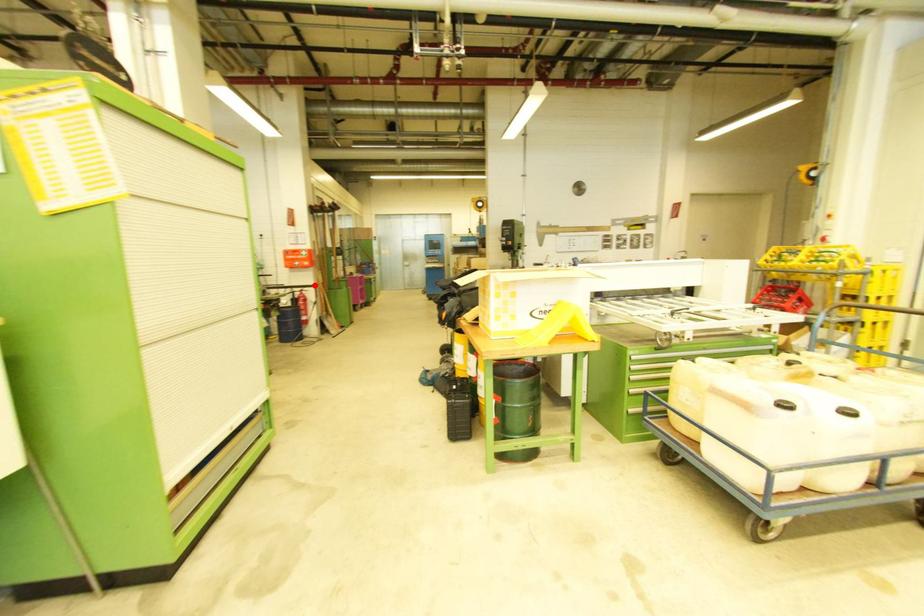
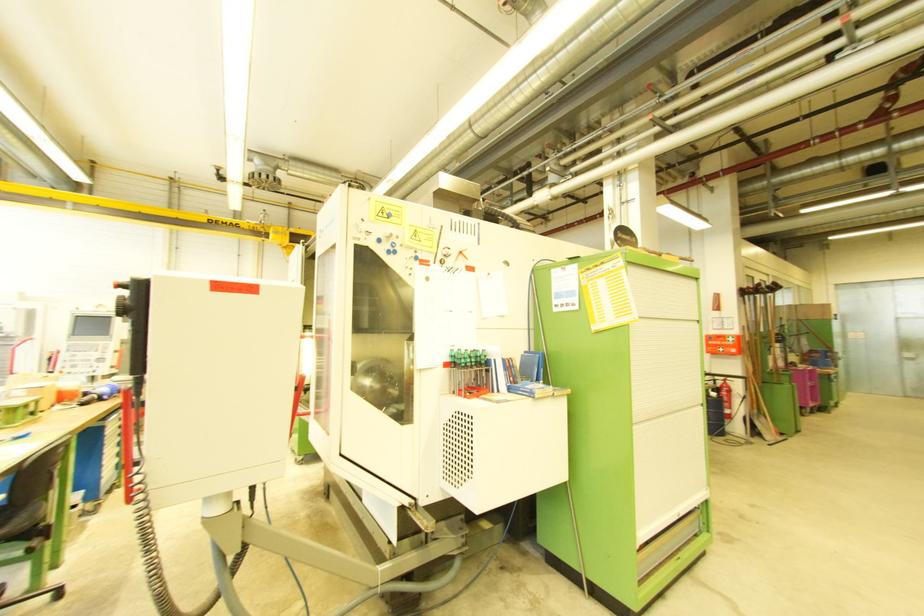
Locate, in the second image, the point that corresponds to the highlighted location in the first image.

(740, 376)